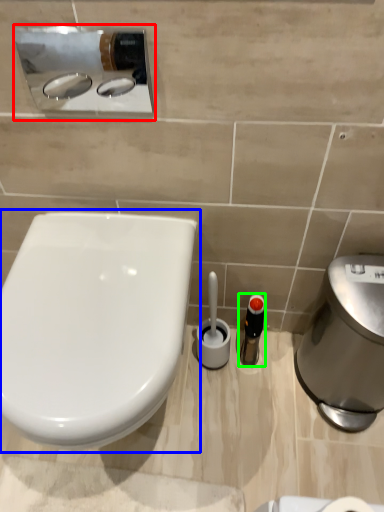
Question: Considering the real-world distances, which object is farthest from sink (highlighted by a red box)? toilet (highlighted by a blue box) or toiletry (highlighted by a green box)?

Choices:
 (A) toilet
 (B) toiletry

Answer: (B)